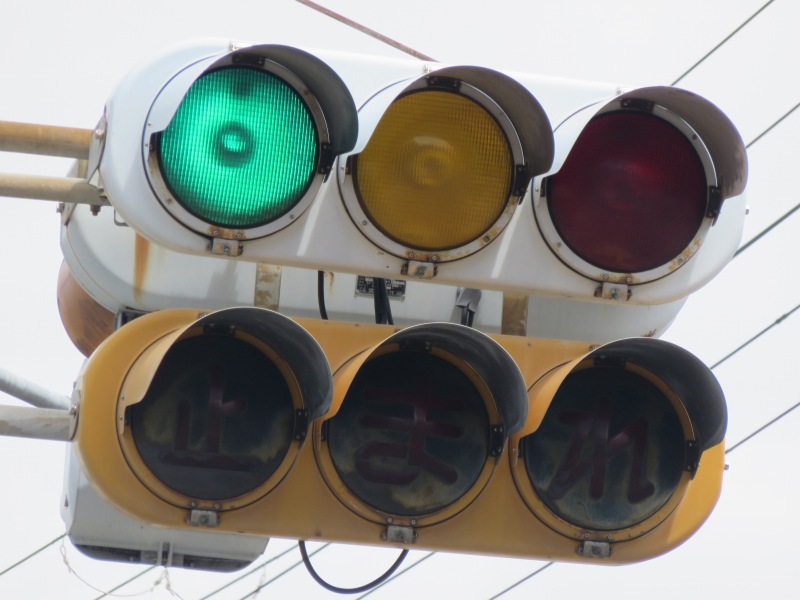
Locate an element on the screen. light is located at coordinates (510, 517).